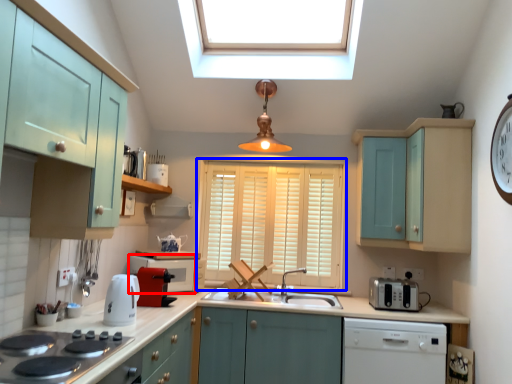
Question: Among these objects, which one is nearest to the camera, appliance (highlighted by a red box) or window (highlighted by a blue box)?

Choices:
 (A) appliance
 (B) window

Answer: (A)